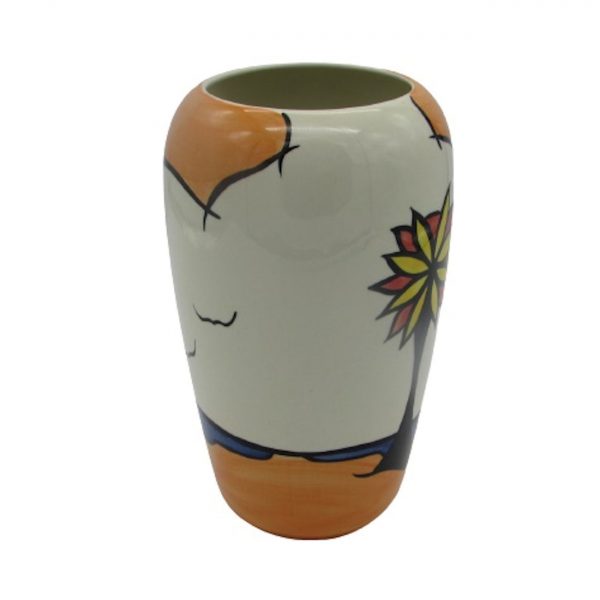
Where is `painted flower design`? painted flower design is located at coordinates (426, 278).